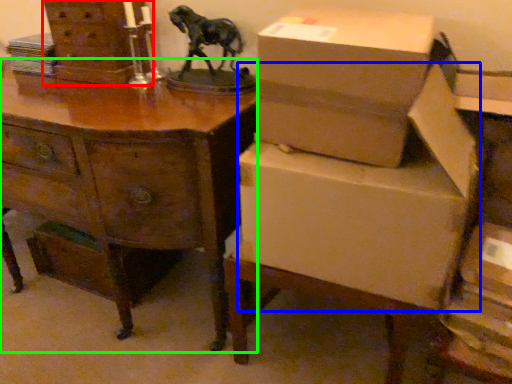
Question: Which object is the closest to the chest of drawers (highlighted by a red box)? Choose among these: cardboard box (highlighted by a blue box) or desk (highlighted by a green box).

Choices:
 (A) cardboard box
 (B) desk

Answer: (B)